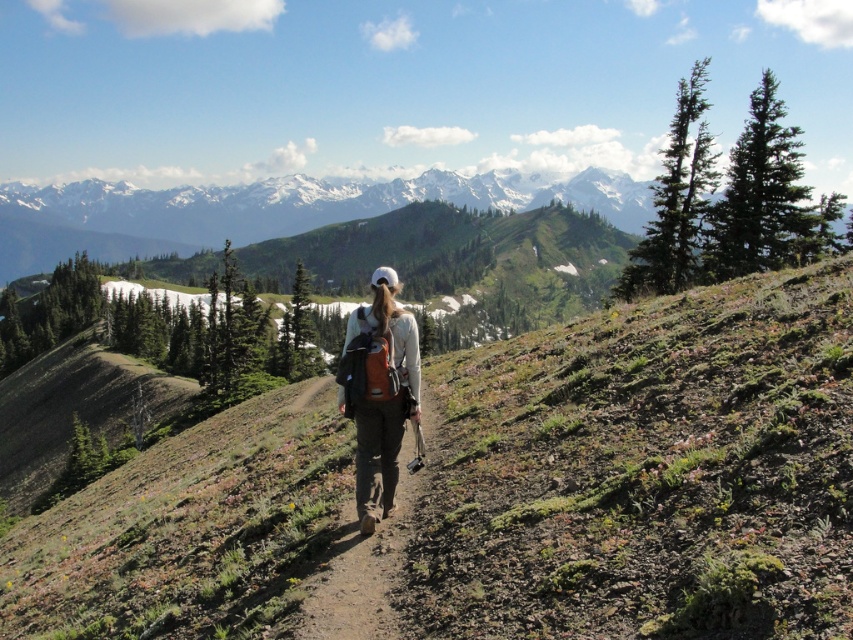
This screenshot has height=640, width=853. What do you see at coordinates (381, 394) in the screenshot? I see `white matte backpack at center` at bounding box center [381, 394].

Is point (370, 314) in front of point (317, 616)?

No, it is not.

Where is `white matte backpack at center`? This screenshot has width=853, height=640. white matte backpack at center is located at coordinates coord(381,394).